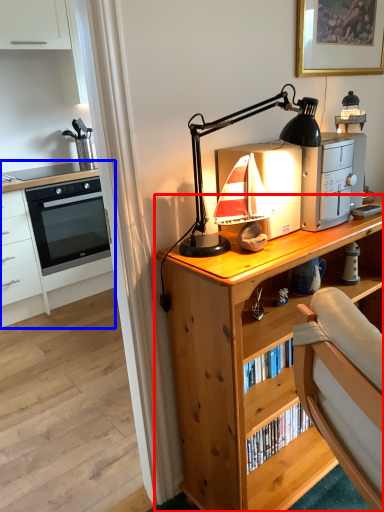
Question: Which object is closer to the camera taking this photo, desk (highlighted by a red box) or chest of drawers (highlighted by a blue box)?

Choices:
 (A) desk
 (B) chest of drawers

Answer: (A)